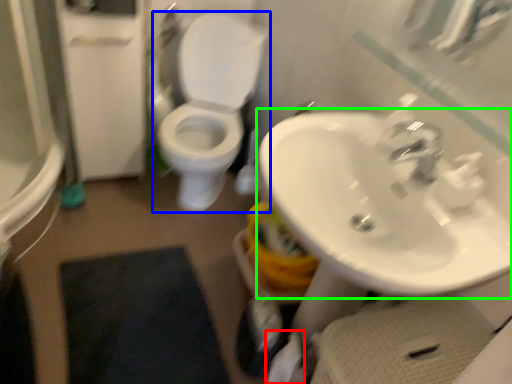
Question: Based on their relative distances, which object is farther from toilet paper (highlighted by a red box)? Choose from toilet (highlighted by a blue box) and sink (highlighted by a green box).

Choices:
 (A) toilet
 (B) sink

Answer: (A)